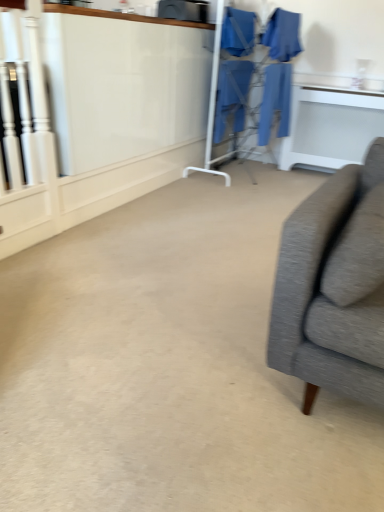
Question: Is blue fabric robe at center, marked as the 1th robe in a left-to-right arrangement, spatially inside blue fabric robe at center, the second robe positioned from the left, or outside of it?

Choices:
 (A) outside
 (B) inside

Answer: (A)

Question: In the image, is blue fabric robe at center, the 4th robe when ordered from right to left, positioned in front of or behind blue fabric robe at center, the third robe when ordered from right to left?

Choices:
 (A) behind
 (B) front

Answer: (B)

Question: Estimate the real-world distances between objects in this image. Which object is closer to the white glossy table at upper right?

Choices:
 (A) blue fabric robe at center, the third robe when ordered from right to left
 (B) blue fabric robe at center, which appears as the 1th robe when viewed from the right
 (C) blue fabric robe at upper center, the third robe in the left-to-right sequence
 (D) blue fabric robe at center, the 4th robe when ordered from right to left
 (E) blue fabric laundry at center

Answer: (B)

Question: Which is nearer to the blue fabric laundry at center?

Choices:
 (A) blue fabric robe at center, which appears as the 1th robe when viewed from the right
 (B) blue fabric robe at upper center, the third robe in the left-to-right sequence
 (C) white glossy table at upper right
 (D) blue fabric robe at center, the 4th robe when ordered from right to left
 (E) blue fabric robe at center, the third robe when ordered from right to left

Answer: (E)